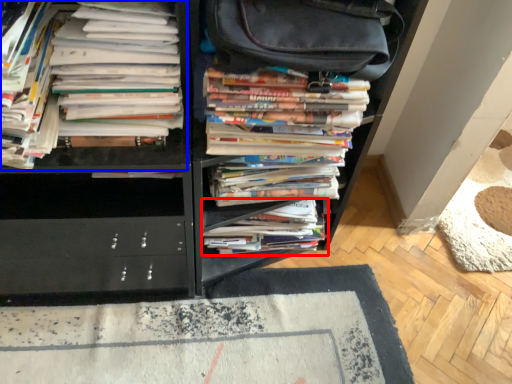
Question: Among these objects, which one is farthest to the camera, book (highlighted by a red box) or book (highlighted by a blue box)?

Choices:
 (A) book
 (B) book

Answer: (A)